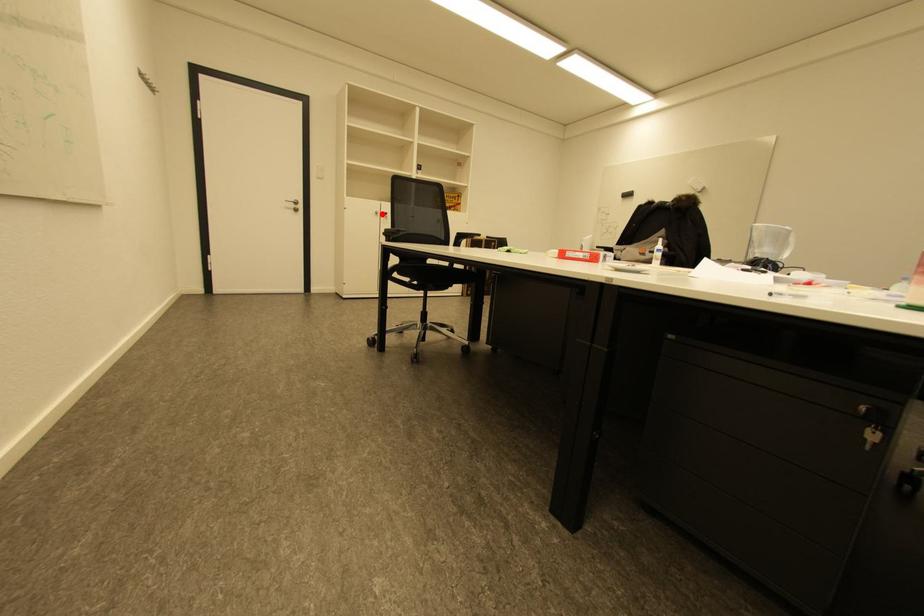
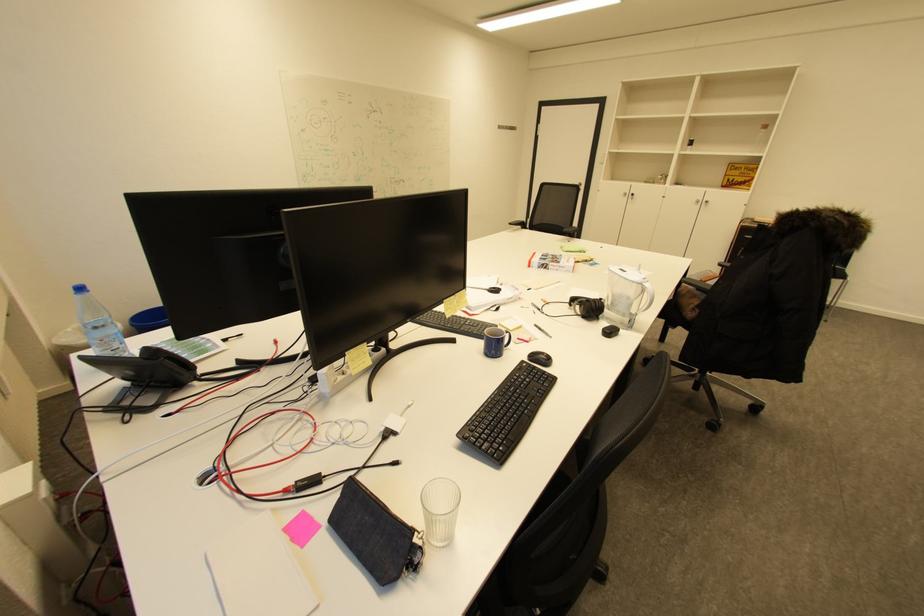
Question: I am providing you with two images of the same scene from different viewpoints. In image1, a red point is highlighted. Considering the same 3D point in image2, which of the following is correct?

Choices:
 (A) It is closer
 (B) It is farther

Answer: (B)